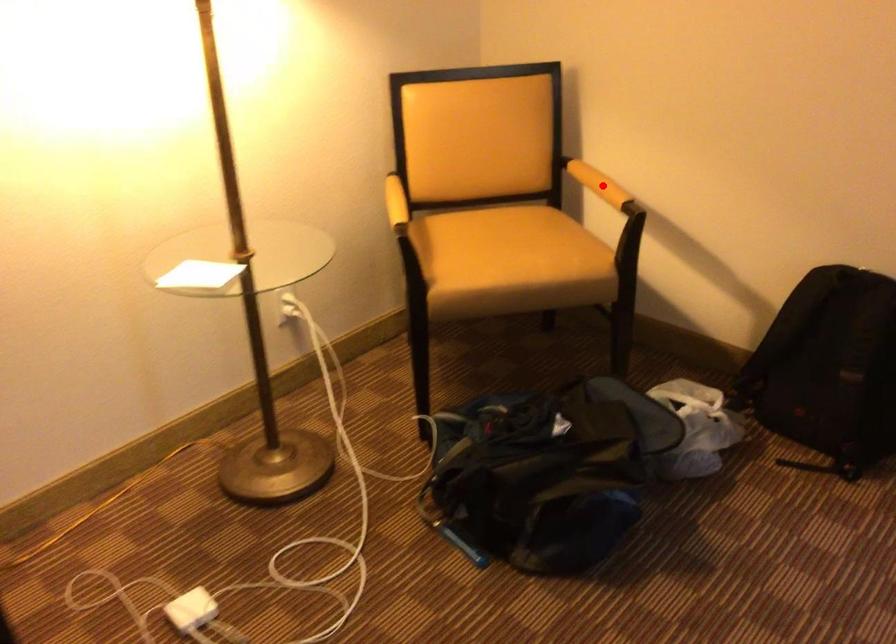
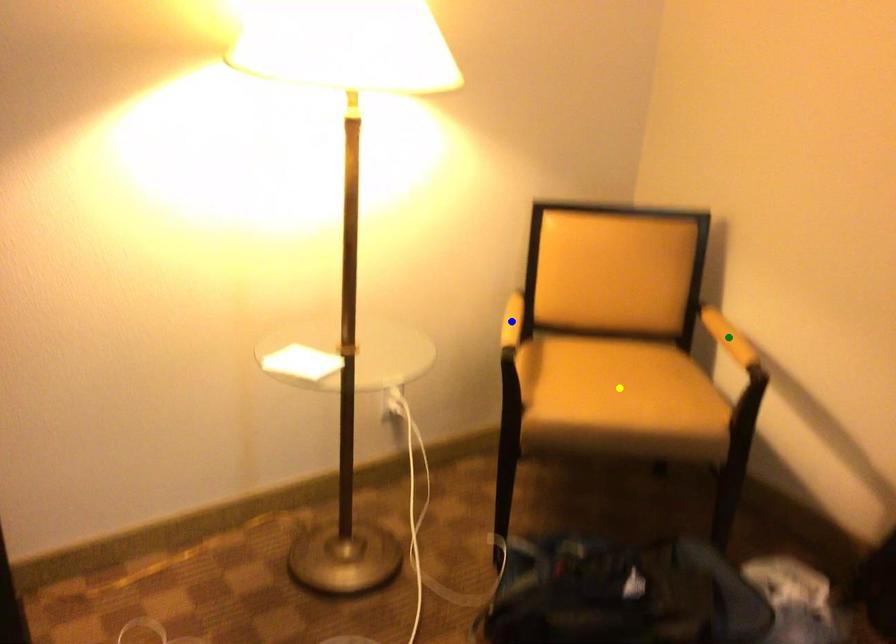
Question: I am providing you with two images of the same scene from different viewpoints. A red point is marked on the first image. You are given multiple points on the second image. Can you choose the point in image 2 that corresponds to the point in image 1?

Choices:
 (A) green point
 (B) yellow point
 (C) blue point

Answer: (A)